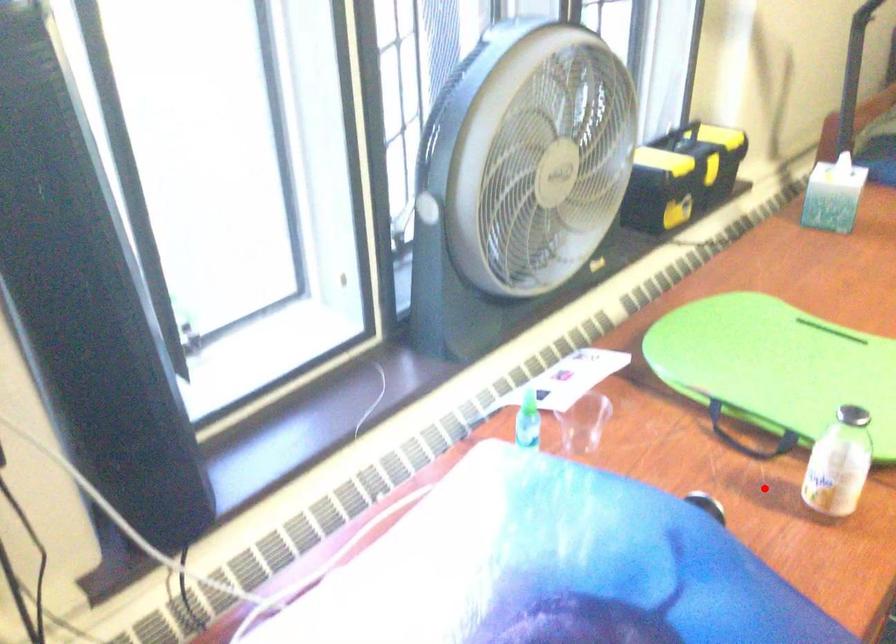
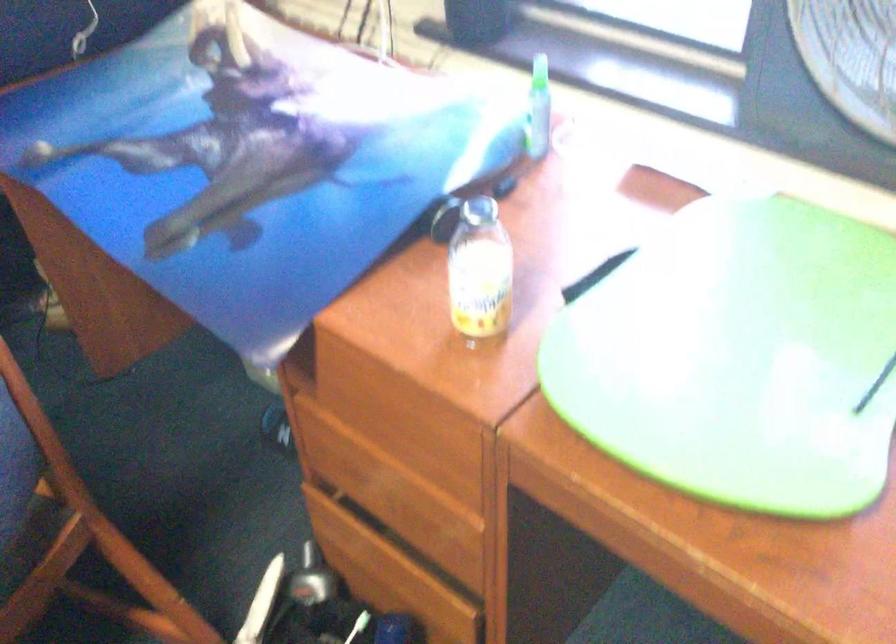
Question: I am providing you with two images of the same scene from different viewpoints. Image1 has a red point marked. In image2, the corresponding 3D location appears at what relative position? Reply with the corresponding letter.

Choices:
 (A) Closer
 (B) Farther

Answer: (A)